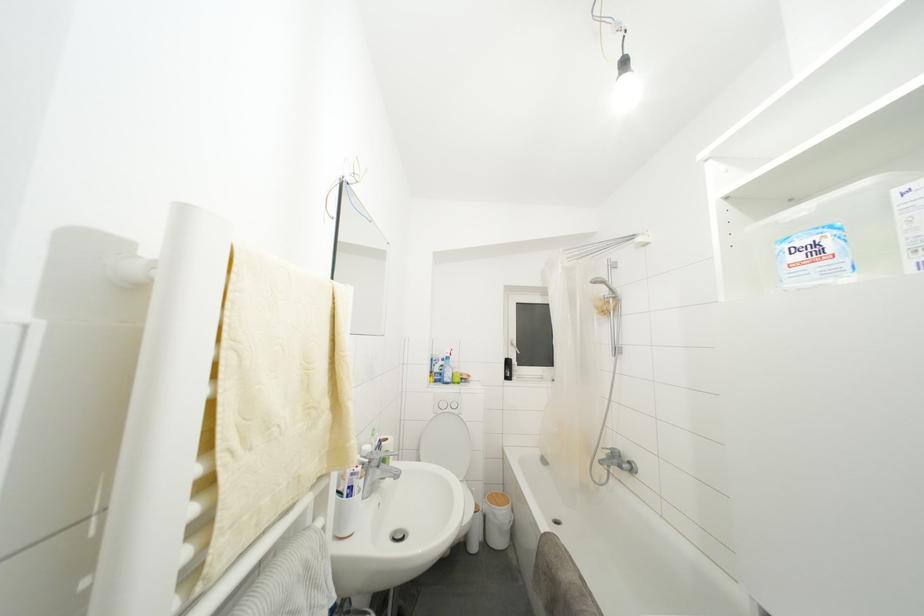
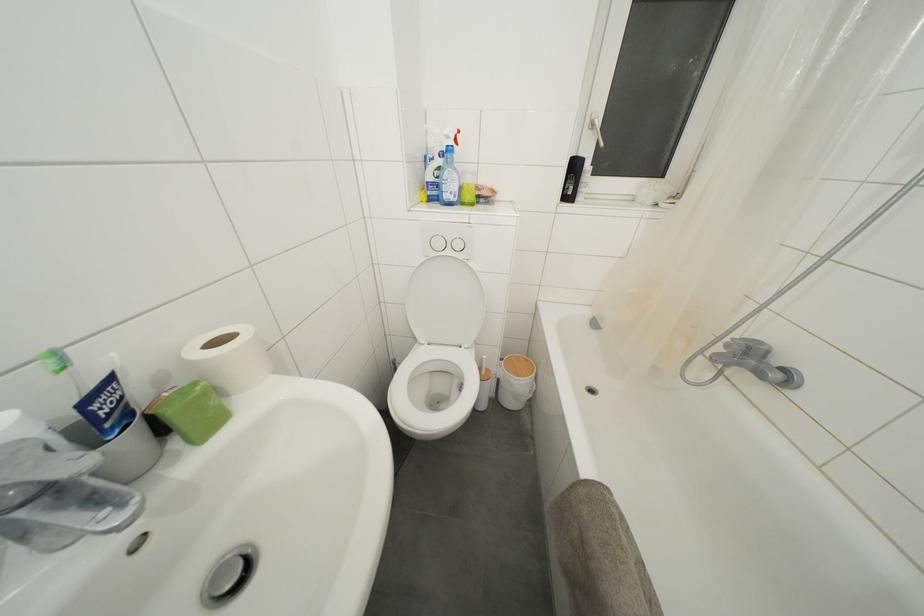
In the second image, find the point that corresponds to (x=447, y=410) in the first image.

(443, 249)